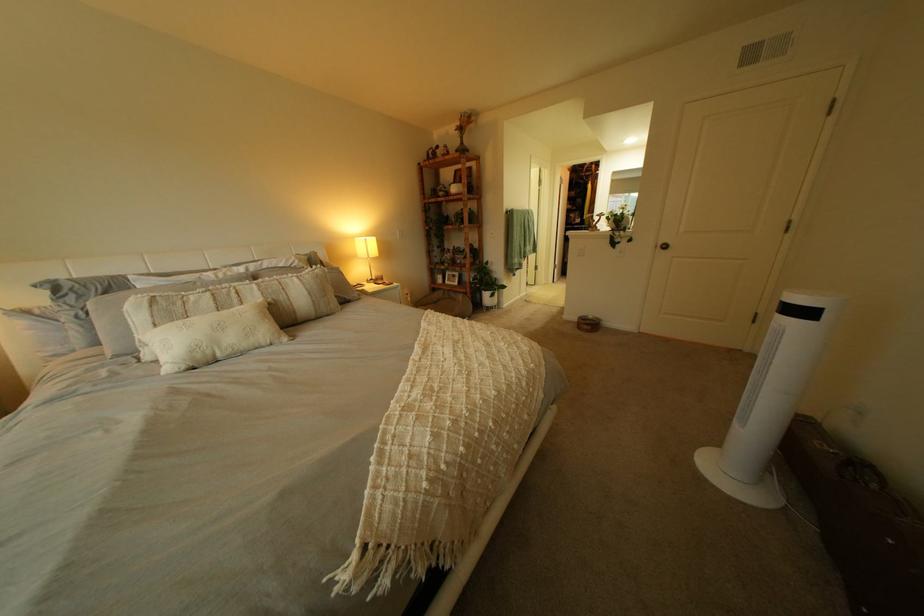
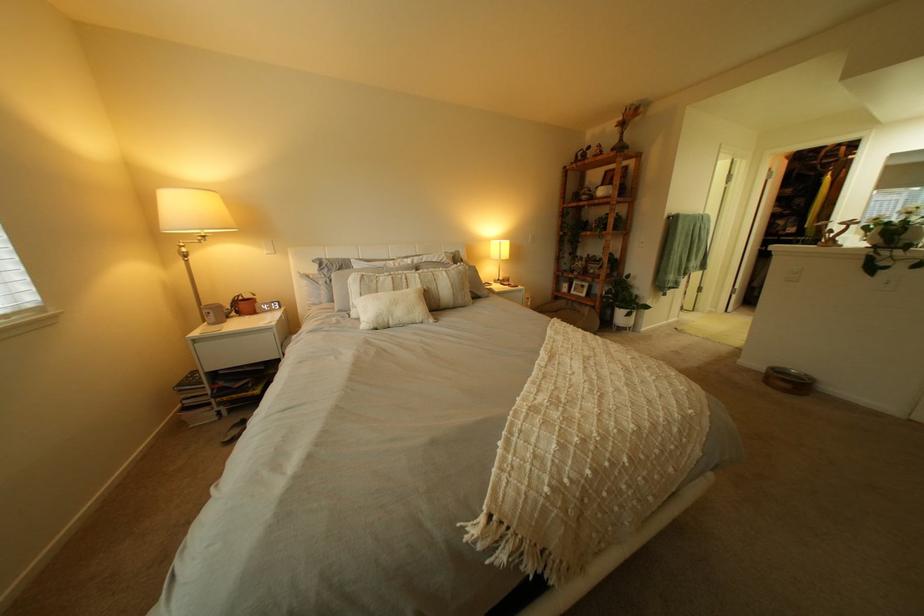
In the second image, find the point that corresponds to the point at 591,320 in the first image.

(779, 369)